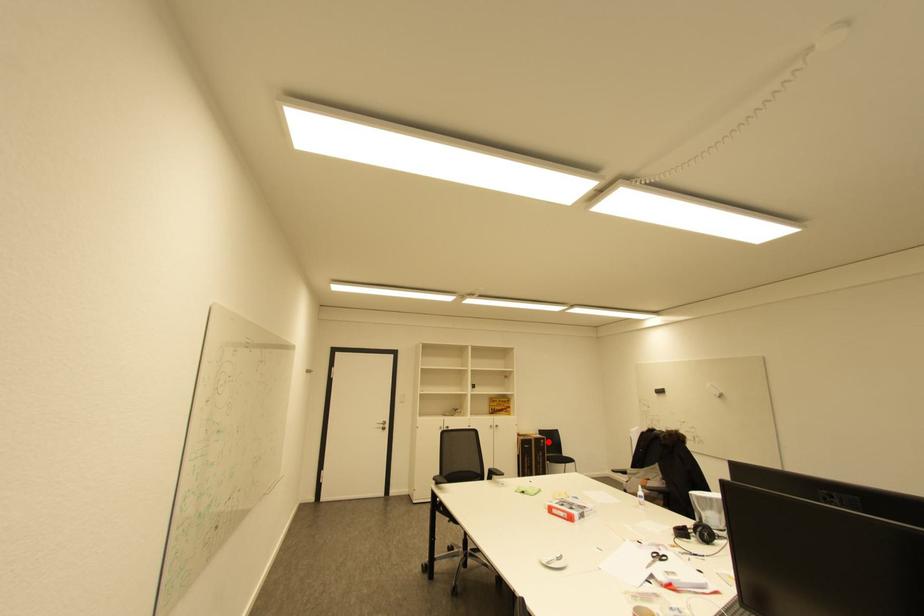
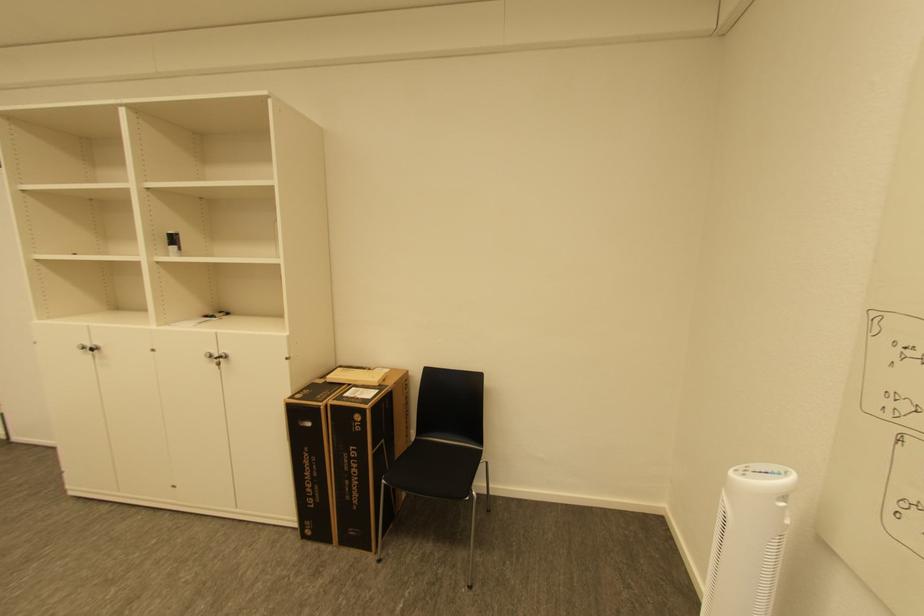
Locate, in the second image, the point that corresponds to the highlighted location in the first image.

(363, 418)